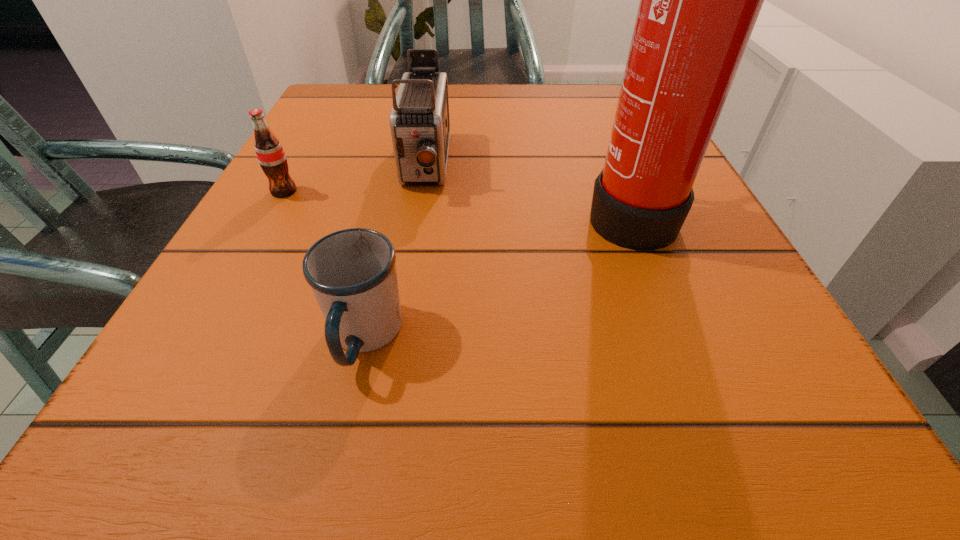
At what (x,y) coordinates should I click in order to perform the action: click on free space located at the lens of the second tallest object. Please return your answer as a coordinate pair (x, y). The height and width of the screenshot is (540, 960). Looking at the image, I should click on (416, 222).

Identify the location of free space located 0.270m on the back of the leftmost object. The image size is (960, 540). (327, 113).

Locate an element on the screen. Image resolution: width=960 pixels, height=540 pixels. vacant area situated 0.050m on the handle side of the mug is located at coordinates (344, 431).

Identify the location of object present at the far edge. 419,121.

This screenshot has height=540, width=960. What are the coordinates of `object at the left edge` in the screenshot? It's located at (270, 154).

What are the coordinates of `object that is at the right edge` in the screenshot? It's located at [x=699, y=0].

I want to click on vacant space at the near edge of the desktop, so click(x=300, y=474).

Identify the location of vacant space at the left edge. Image resolution: width=960 pixels, height=540 pixels. (279, 319).

Locate an element on the screen. The image size is (960, 540). blank space at the right edge of the desktop is located at coordinates (746, 286).

Locate an element on the screen. This screenshot has width=960, height=540. free space at the far left corner is located at coordinates (370, 111).